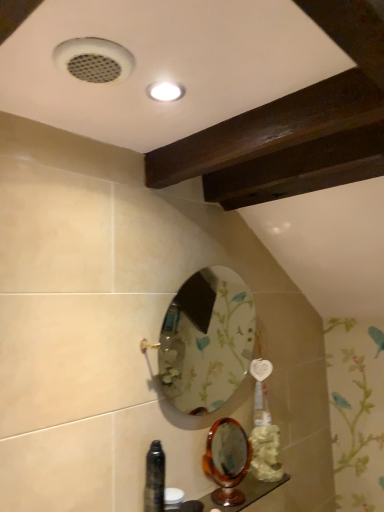
The height and width of the screenshot is (512, 384). Find the location of `wooden polished counter top at lower center`. wooden polished counter top at lower center is located at coordinates (254, 490).

Locate an element on the screen. The height and width of the screenshot is (512, 384). wooden polished mirror at lower center, acting as the 2th mirror starting from the top is located at coordinates (227, 460).

Which of these two, black glossy bottle at lower left or wooden polished mirror at lower center, placed as the first mirror when sorted from bottom to top, is thinner?

With smaller width is black glossy bottle at lower left.

From the image's perspective, is black glossy bottle at lower left located above or below wooden polished mirror at lower center, acting as the 2th mirror starting from the top?

From the image's perspective, black glossy bottle at lower left appears above wooden polished mirror at lower center, acting as the 2th mirror starting from the top.

Considering the relative sizes of black glossy bottle at lower left and wooden polished mirror at lower center, acting as the 2th mirror starting from the top, in the image provided, is black glossy bottle at lower left taller than wooden polished mirror at lower center, acting as the 2th mirror starting from the top,?

Yes, black glossy bottle at lower left is taller than wooden polished mirror at lower center, acting as the 2th mirror starting from the top.

How far apart are black glossy bottle at lower left and wooden polished mirror at lower center, placed as the first mirror when sorted from bottom to top?

black glossy bottle at lower left is 9.75 inches from wooden polished mirror at lower center, placed as the first mirror when sorted from bottom to top.

Do you think wooden polished counter top at lower center is within black glossy bottle at lower left, or outside of it?

wooden polished counter top at lower center is not enclosed by black glossy bottle at lower left.

How far apart are wooden polished counter top at lower center and black glossy bottle at lower left?

The distance of wooden polished counter top at lower center from black glossy bottle at lower left is 9.75 inches.

From the picture: Are wooden polished counter top at lower center and black glossy bottle at lower left making contact?

No, wooden polished counter top at lower center is not next to black glossy bottle at lower left.

Does wooden polished mirror at lower center, placed as the first mirror when sorted from bottom to top, have a greater width compared to wooden polished counter top at lower center?

In fact, wooden polished mirror at lower center, placed as the first mirror when sorted from bottom to top, might be narrower than wooden polished counter top at lower center.

Considering the points (241, 474) and (204, 496), which point is in front, point (241, 474) or point (204, 496)?

Point (204, 496)

Based on the photo, from the image's perspective, is wooden polished mirror at lower center, acting as the 2th mirror starting from the top, located above or below wooden polished counter top at lower center?

wooden polished mirror at lower center, acting as the 2th mirror starting from the top, is situated higher than wooden polished counter top at lower center in the image.

Is wooden polished mirror at lower center, acting as the 2th mirror starting from the top, to the left of wooden polished counter top at lower center from the viewer's perspective?

Indeed, wooden polished mirror at lower center, acting as the 2th mirror starting from the top, is positioned on the left side of wooden polished counter top at lower center.

Does wooden polished counter top at lower center have a lesser width compared to wooden polished mirror at lower center, placed as the first mirror when sorted from bottom to top?

No.

Is wooden polished counter top at lower center positioned in front of wooden polished mirror at lower center, placed as the first mirror when sorted from bottom to top?

Yes.

Which is more to the left, wooden polished counter top at lower center or wooden polished mirror at lower center, acting as the 2th mirror starting from the top?

From the viewer's perspective, wooden polished mirror at lower center, acting as the 2th mirror starting from the top, appears more on the left side.

What's the angular difference between wooden polished counter top at lower center and wooden polished mirror at lower center, acting as the 2th mirror starting from the top,'s facing directions?

They differ by 12.7 degrees in their facing directions.

Does black glossy bottle at lower left lie behind wooden polished counter top at lower center?

No, black glossy bottle at lower left is in front of wooden polished counter top at lower center.

Is black glossy bottle at lower left thinner than wooden polished counter top at lower center?

Yes.

Would you say black glossy bottle at lower left is a long distance from wooden polished counter top at lower center?

black glossy bottle at lower left is actually quite close to wooden polished counter top at lower center.

Is black glossy bottle at lower left aimed at wooden polished counter top at lower center?

No.

Can you tell me how much wooden polished counter top at lower center and floral-patterned glass mirror at center, which is counted as the 2th mirror, starting from the bottom, differ in facing direction?

0.475 degrees.

Considering the sizes of objects wooden polished counter top at lower center and floral-patterned glass mirror at center, which is counted as the 2th mirror, starting from the bottom, in the image provided, who is smaller, wooden polished counter top at lower center or floral-patterned glass mirror at center, which is counted as the 2th mirror, starting from the bottom,?

With smaller size is wooden polished counter top at lower center.

How distant is wooden polished counter top at lower center from floral-patterned glass mirror at center, the 1th mirror positioned from the top?

wooden polished counter top at lower center is 34.75 inches away from floral-patterned glass mirror at center, the 1th mirror positioned from the top.

Is wooden polished counter top at lower center spatially inside floral-patterned glass mirror at center, the 1th mirror positioned from the top, or outside of it?

wooden polished counter top at lower center lies outside floral-patterned glass mirror at center, the 1th mirror positioned from the top.

Considering the points (200, 274) and (176, 511), which point is in front, point (200, 274) or point (176, 511)?

The point (176, 511) is more forward.

Considering the relative positions of floral-patterned glass mirror at center, which is counted as the 2th mirror, starting from the bottom, and wooden polished counter top at lower center in the image provided, is floral-patterned glass mirror at center, which is counted as the 2th mirror, starting from the bottom, to the right of wooden polished counter top at lower center from the viewer's perspective?

In fact, floral-patterned glass mirror at center, which is counted as the 2th mirror, starting from the bottom, is to the left of wooden polished counter top at lower center.

Is floral-patterned glass mirror at center, which is counted as the 2th mirror, starting from the bottom, smaller than wooden polished counter top at lower center?

Incorrect, floral-patterned glass mirror at center, which is counted as the 2th mirror, starting from the bottom, is not smaller in size than wooden polished counter top at lower center.

Which mirror is the 2nd one when counting from the back of the black glossy bottle at lower left? Please provide its 2D coordinates.

[(227, 460)]

Where is `counter top below the black glossy bottle at lower left (from the image's perspective)`? counter top below the black glossy bottle at lower left (from the image's perspective) is located at coordinates 254,490.

Considering their positions, is floral-patterned glass mirror at center, the 1th mirror positioned from the top, positioned closer to wooden polished mirror at lower center, placed as the first mirror when sorted from bottom to top, than wooden polished counter top at lower center?

The object closer to wooden polished mirror at lower center, placed as the first mirror when sorted from bottom to top, is wooden polished counter top at lower center.

Considering their positions, is wooden polished counter top at lower center positioned further to floral-patterned glass mirror at center, which is counted as the 2th mirror, starting from the bottom, than black glossy bottle at lower left?

Based on the image, black glossy bottle at lower left appears to be further to floral-patterned glass mirror at center, which is counted as the 2th mirror, starting from the bottom.

From the image, which object appears to be nearer to black glossy bottle at lower left, wooden polished counter top at lower center or floral-patterned glass mirror at center, the 1th mirror positioned from the top?

Based on the image, wooden polished counter top at lower center appears to be nearer to black glossy bottle at lower left.

From the image, which object appears to be nearer to wooden polished counter top at lower center, floral-patterned glass mirror at center, which is counted as the 2th mirror, starting from the bottom, or wooden polished mirror at lower center, acting as the 2th mirror starting from the top?

wooden polished mirror at lower center, acting as the 2th mirror starting from the top, lies closer to wooden polished counter top at lower center than the other object.

When comparing their distances from wooden polished counter top at lower center, does black glossy bottle at lower left or floral-patterned glass mirror at center, the 1th mirror positioned from the top, seem closer?

black glossy bottle at lower left.

Which object lies nearer to the anchor point floral-patterned glass mirror at center, the 1th mirror positioned from the top, black glossy bottle at lower left or wooden polished counter top at lower center?

wooden polished counter top at lower center is positioned closer to the anchor floral-patterned glass mirror at center, the 1th mirror positioned from the top.

Estimate the real-world distances between objects in this image. Which object is further from floral-patterned glass mirror at center, the 1th mirror positioned from the top, wooden polished mirror at lower center, placed as the first mirror when sorted from bottom to top, or wooden polished counter top at lower center?

wooden polished mirror at lower center, placed as the first mirror when sorted from bottom to top.

When comparing their distances from wooden polished counter top at lower center, does wooden polished mirror at lower center, placed as the first mirror when sorted from bottom to top, or black glossy bottle at lower left seem further?

The object further to wooden polished counter top at lower center is black glossy bottle at lower left.

Find the location of a particular element. bottle between floral-patterned glass mirror at center, the 1th mirror positioned from the top, and wooden polished counter top at lower center from top to bottom is located at coordinates 155,478.

The height and width of the screenshot is (512, 384). Identify the location of mirror between floral-patterned glass mirror at center, the 1th mirror positioned from the top, and wooden polished counter top at lower center in the up-down direction. (227, 460).

I want to click on bottle between floral-patterned glass mirror at center, which is counted as the 2th mirror, starting from the bottom, and wooden polished mirror at lower center, acting as the 2th mirror starting from the top, from top to bottom, so click(x=155, y=478).